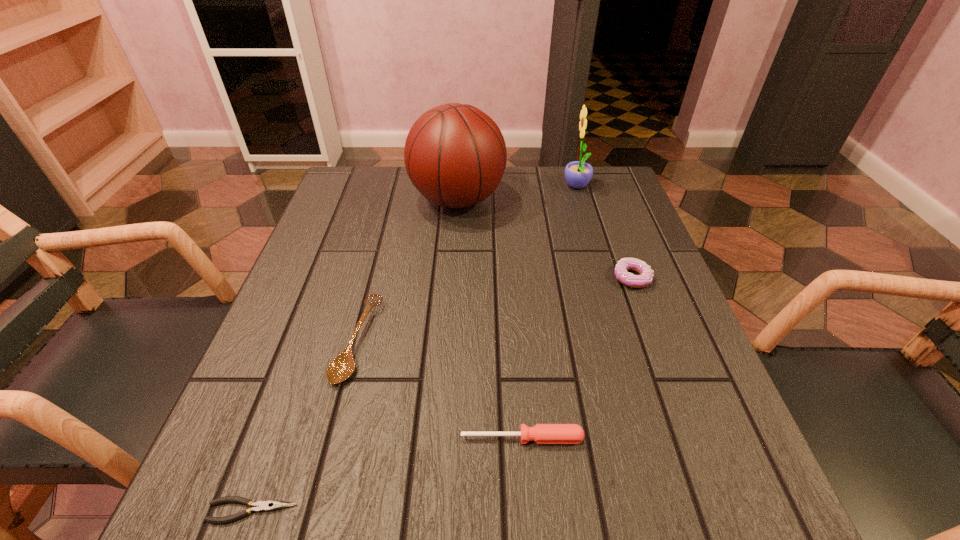
Identify the location of vacant space that's between the sunflower and the shortest object. The image size is (960, 540). (415, 349).

Where is `object that stands as the second closest to the fourth shortest object`? This screenshot has height=540, width=960. object that stands as the second closest to the fourth shortest object is located at coordinates (578, 174).

Identify the location of object that is the second nearest to the nearest object. (541, 433).

Find the location of `free space that satisfies the following two spatial constraints: 1. on the back side of the pliers; 2. on the left side of the basketball`. free space that satisfies the following two spatial constraints: 1. on the back side of the pliers; 2. on the left side of the basketball is located at coordinates (362, 200).

Where is `vacant region that satisfies the following two spatial constraints: 1. on the front side of the basketball; 2. on the left side of the fourth nearest object`? vacant region that satisfies the following two spatial constraints: 1. on the front side of the basketball; 2. on the left side of the fourth nearest object is located at coordinates (452, 278).

The width and height of the screenshot is (960, 540). Find the location of `free space that satisfies the following two spatial constraints: 1. on the back side of the ladle; 2. on the right side of the pliers`. free space that satisfies the following two spatial constraints: 1. on the back side of the ladle; 2. on the right side of the pliers is located at coordinates (312, 340).